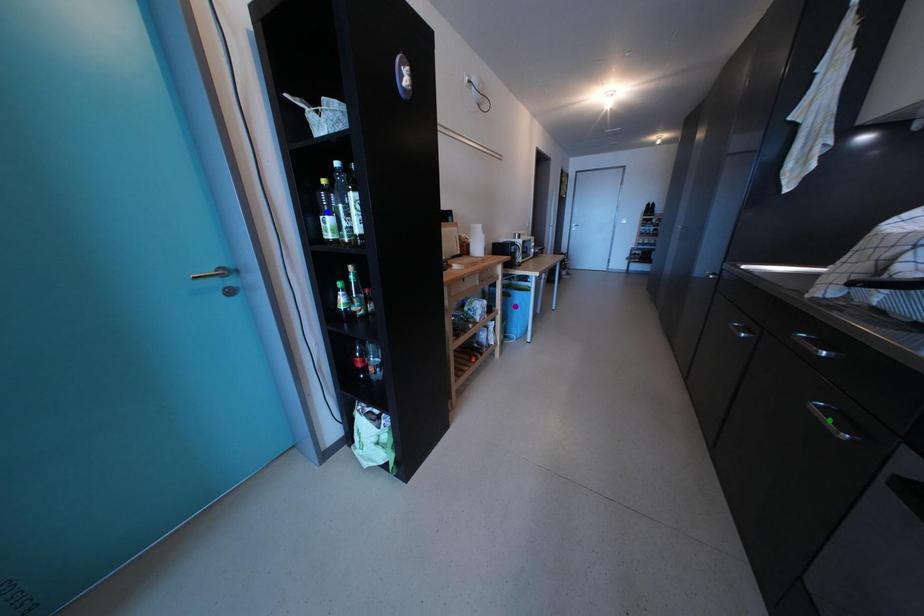
Order these from farthest to nearest:
1. purple point
2. green point
3. blue point

1. purple point
2. blue point
3. green point